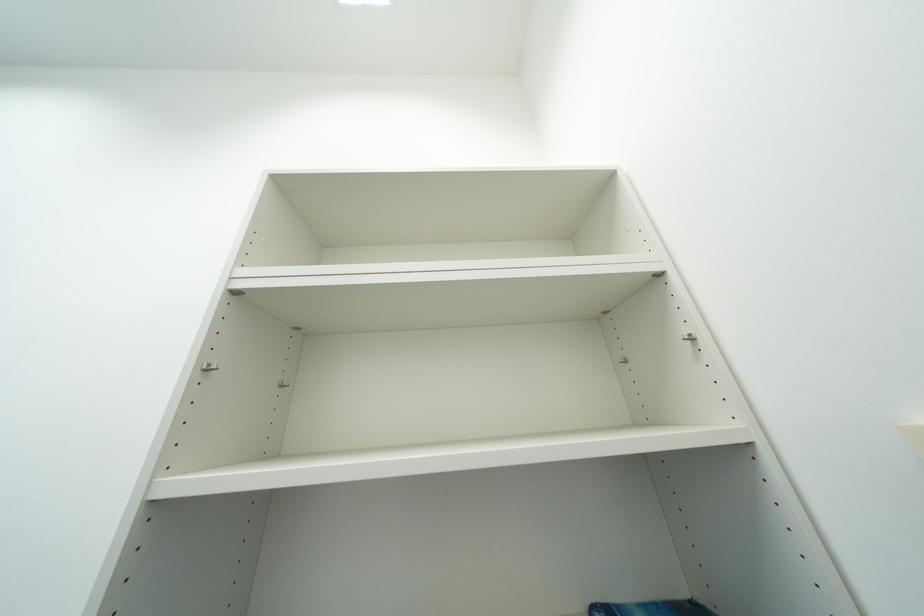
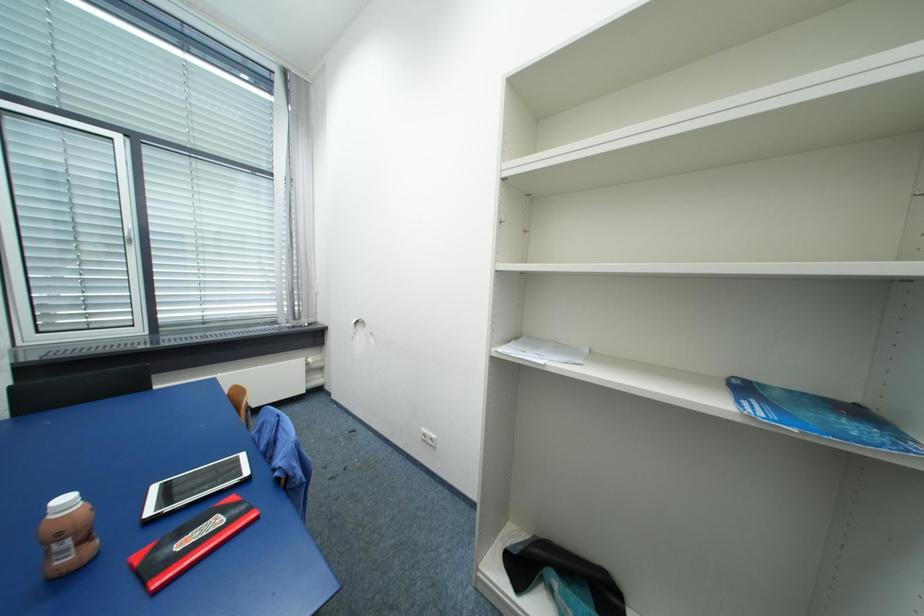
How did the camera likely rotate?

The rotation direction of the camera is left-down.